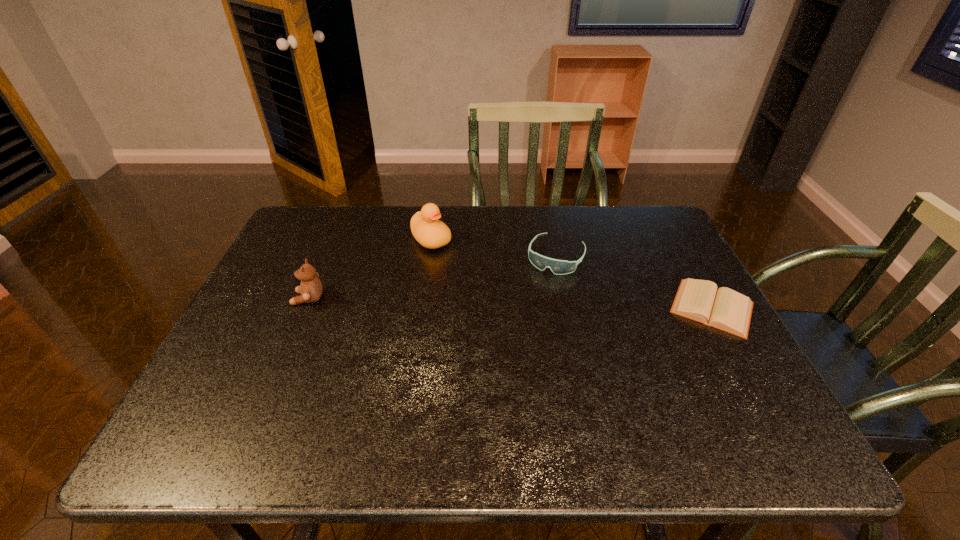
The height and width of the screenshot is (540, 960). Find the location of `the leftmost object`. the leftmost object is located at coordinates (311, 288).

Image resolution: width=960 pixels, height=540 pixels. I want to click on the rightmost object, so click(699, 300).

Identify the location of diary. (699, 300).

Image resolution: width=960 pixels, height=540 pixels. I want to click on the third object from right to left, so click(x=430, y=232).

Identify the location of the third object from left to right. (559, 267).

Where is `goggles`? Image resolution: width=960 pixels, height=540 pixels. goggles is located at coordinates (559, 267).

Identify the location of vacant area located 0.110m on the front-facing side of the leftmost object. This screenshot has height=540, width=960. (251, 299).

This screenshot has height=540, width=960. Find the location of `vacant area situated on the front-facing side of the leftmost object`. vacant area situated on the front-facing side of the leftmost object is located at coordinates (266, 299).

The width and height of the screenshot is (960, 540). Find the location of `vacant space situated on the front-facing side of the leftmost object`. vacant space situated on the front-facing side of the leftmost object is located at coordinates (270, 299).

In order to click on free location located on the left of the shortest object in this screenshot , I will do pos(529,307).